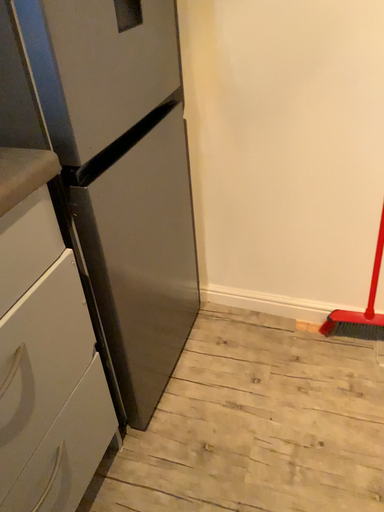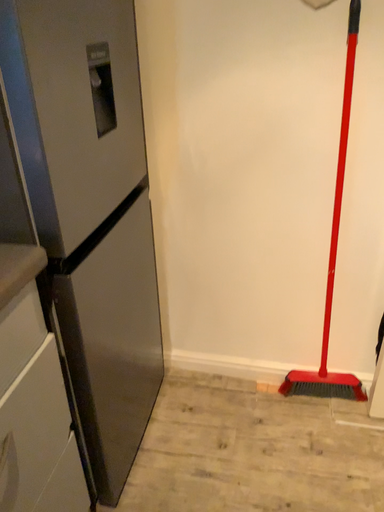
Question: Which way did the camera rotate in the video?

Choices:
 (A) rotated upward
 (B) rotated downward

Answer: (A)